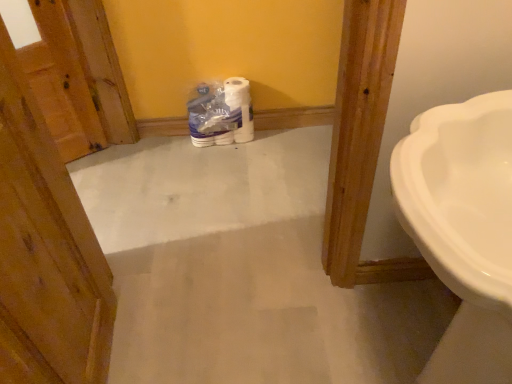
You are a GUI agent. You are given a task and a screenshot of the screen. Output one action in this format:
    pyautogui.click(x=<x>, y=<y>)
    Task: Click on the white glossy toilet paper at center
    This screenshot has height=384, width=512.
    Given the screenshot: What is the action you would take?
    pyautogui.click(x=221, y=113)

Measure the distance between wooden door at left and camera.

They are 27.56 inches apart.

Find the location of a particular element. white glossy toilet paper at center is located at coordinates (221, 113).

In terms of width, does wooden door at left look wider or thinner when compared to white glossy sink at right?

Considering their sizes, wooden door at left looks slimmer than white glossy sink at right.

Where is `sink below the wooden door at left (from the image's perspective)`? The height and width of the screenshot is (384, 512). sink below the wooden door at left (from the image's perspective) is located at coordinates (463, 228).

From the image's perspective, would you say wooden door at left is shown under white glossy sink at right?

No, from the image's perspective, wooden door at left is not below white glossy sink at right.

Could you tell me if wooden door at left is facing white glossy sink at right?

Yes, wooden door at left faces towards white glossy sink at right.

Is white glossy toilet paper at center closer to the viewer compared to white glossy sink at right?

No, it is not.

Considering the relative sizes of white glossy toilet paper at center and white glossy sink at right in the image provided, is white glossy toilet paper at center bigger than white glossy sink at right?

Actually, white glossy toilet paper at center might be smaller than white glossy sink at right.

Is white glossy sink at right surrounded by white glossy toilet paper at center?

Actually, white glossy sink at right is outside white glossy toilet paper at center.

Can you confirm if white glossy toilet paper at center is thinner than white glossy sink at right?

Indeed, white glossy toilet paper at center has a lesser width compared to white glossy sink at right.

Is wooden door at left positioned far away from white glossy toilet paper at center?

Yes.

From the image's perspective, does wooden door at left appear higher than white glossy toilet paper at center?

No.

In the scene shown: From a real-world perspective, does wooden door at left stand above white glossy toilet paper at center?

Indeed, from a real-world perspective, wooden door at left stands above white glossy toilet paper at center.

Can you confirm if wooden door at left is wider than white glossy toilet paper at center?

No, wooden door at left is not wider than white glossy toilet paper at center.

Is white glossy sink at right positioned far away from white glossy toilet paper at center?

Absolutely, white glossy sink at right is distant from white glossy toilet paper at center.

Based on the photo, relative to white glossy toilet paper at center, is white glossy sink at right in front or behind?

Clearly, white glossy sink at right is in front of white glossy toilet paper at center.

Is point (453, 198) behind point (196, 90)?

No, (453, 198) is in front of (196, 90).

From the image's perspective, would you say white glossy sink at right is shown under white glossy toilet paper at center?

Yes, from the image's perspective, white glossy sink at right is below white glossy toilet paper at center.

Does white glossy sink at right turn towards wooden door at left?

Yes, white glossy sink at right faces towards wooden door at left.

Is white glossy sink at right in front of or behind wooden door at left in the image?

In the image, white glossy sink at right appears behind wooden door at left.

Is white glossy sink at right inside the boundaries of wooden door at left, or outside?

white glossy sink at right lies outside wooden door at left.

Is white glossy sink at right to the right of wooden door at left from the viewer's perspective?

Correct, you'll find white glossy sink at right to the right of wooden door at left.

Can you confirm if white glossy toilet paper at center is wider than wooden door at left?

Yes.

Is white glossy toilet paper at center bigger than wooden door at left?

No.

From the image's perspective, is white glossy toilet paper at center beneath wooden door at left?

No, from the image's perspective, white glossy toilet paper at center is not below wooden door at left.

I want to click on sink that is below the wooden door at left (from the image's perspective), so click(x=463, y=228).

Identify the location of toilet paper below the white glossy sink at right (from a real-world perspective). This screenshot has height=384, width=512. (221, 113).

Considering their positions, is wooden door at left positioned closer to white glossy toilet paper at center than white glossy sink at right?

wooden door at left.

Which object lies further to the anchor point white glossy toilet paper at center, white glossy sink at right or wooden door at left?

white glossy sink at right is positioned further to the anchor white glossy toilet paper at center.

Estimate the real-world distances between objects in this image. Which object is closer to white glossy sink at right, wooden door at left or white glossy toilet paper at center?

wooden door at left is closer to white glossy sink at right.

Looking at the image, which one is located closer to white glossy sink at right, white glossy toilet paper at center or wooden door at left?

wooden door at left lies closer to white glossy sink at right than the other object.

Estimate the real-world distances between objects in this image. Which object is further from wooden door at left, white glossy toilet paper at center or white glossy sink at right?

white glossy toilet paper at center is positioned further to the anchor wooden door at left.

Considering their positions, is white glossy sink at right positioned closer to wooden door at left than white glossy toilet paper at center?

white glossy sink at right is positioned closer to the anchor wooden door at left.

The width and height of the screenshot is (512, 384). I want to click on sink between wooden door at left and white glossy toilet paper at center in the front-back direction, so click(463, 228).